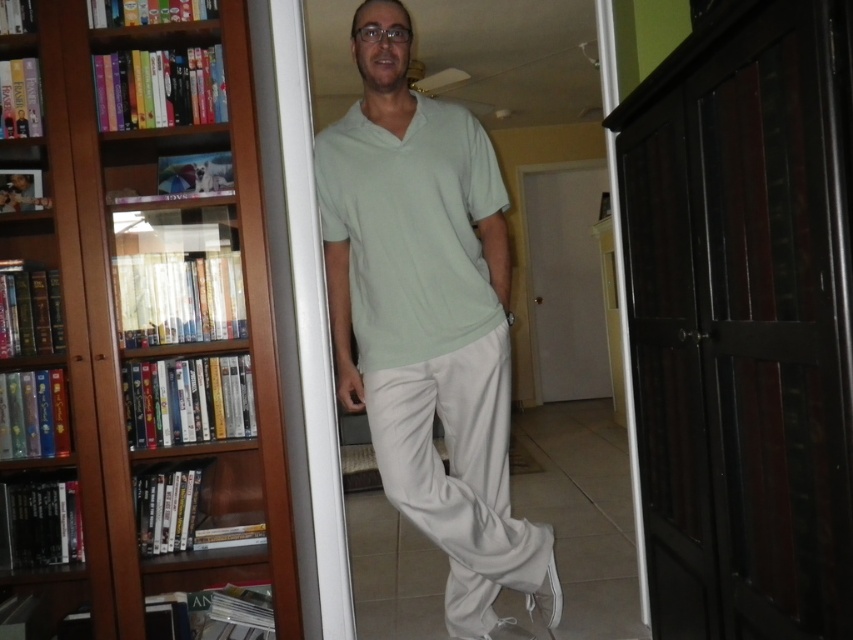
Does light green cotton shirt at center appear over white cotton pants at center?

Indeed, light green cotton shirt at center is positioned over white cotton pants at center.

At what (x,y) coordinates should I click in order to perform the action: click on light green cotton shirt at center. Please return your answer as a coordinate pair (x, y). The width and height of the screenshot is (853, 640). Looking at the image, I should click on (410, 228).

Between light green fabric shirt at center and light green cotton shirt at center, which one appears on the right side from the viewer's perspective?

light green fabric shirt at center is more to the right.

Which of these two, light green fabric shirt at center or light green cotton shirt at center, stands shorter?

light green cotton shirt at center is shorter.

Which is behind, point (432, 321) or point (427, 202)?

The point (432, 321) is more distant.

Locate an element on the screen. light green fabric shirt at center is located at coordinates (428, 323).

Is point (82, 326) in front of point (502, 509)?

Yes, it is in front of point (502, 509).

Is point (80, 554) positioned after point (450, 355)?

No, it is not.

Locate an element on the screen. This screenshot has height=640, width=853. wooden bookcase at left is located at coordinates (137, 332).

This screenshot has width=853, height=640. Find the location of `wooden bookcase at left`. wooden bookcase at left is located at coordinates (137, 332).